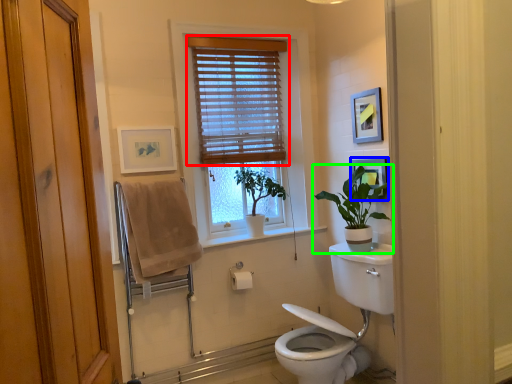
Question: Estimate the real-world distances between objects in this image. Which object is closer to window blind (highlighted by a red box), picture frame (highlighted by a blue box) or houseplant (highlighted by a green box)?

Choices:
 (A) picture frame
 (B) houseplant

Answer: (A)